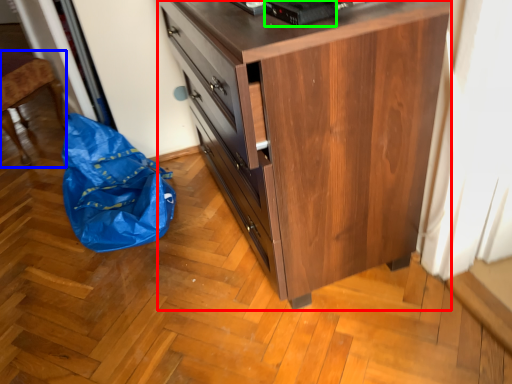
Question: Which is nearer to the chest of drawers (highlighted by a red box)? furniture (highlighted by a blue box) or appliance (highlighted by a green box).

Choices:
 (A) furniture
 (B) appliance

Answer: (B)